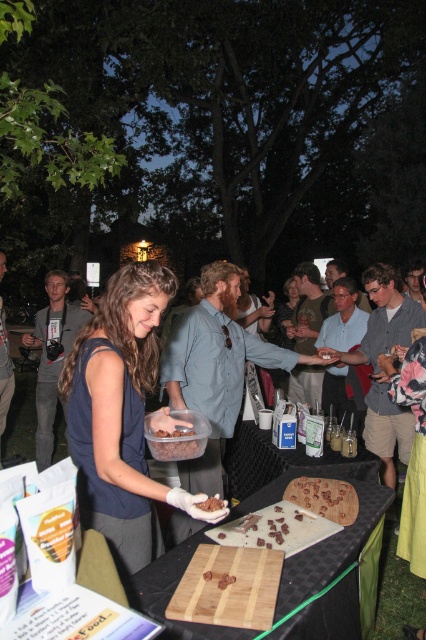
Is dark brown textured nuts at center behind chocolate crumbly at center?

Yes.

Find the location of a particular element. This screenshot has width=426, height=640. dark brown textured nuts at center is located at coordinates (176, 444).

Looking at this image, does matte blue shirt at center have a greater height compared to wooden cutting board at center?

Indeed, matte blue shirt at center has a greater height compared to wooden cutting board at center.

Find the location of a particular element. Image resolution: width=426 pixels, height=640 pixels. matte blue shirt at center is located at coordinates (121, 413).

What are the coordinates of `matte blue shirt at center` in the screenshot? It's located at (121, 413).

Which is more to the right, wooden cutting board at center or chocolate cake at center?

chocolate cake at center is more to the right.

At what (x,y) coordinates should I click in order to perform the action: click on wooden cutting board at center. Please return your answer as a coordinate pair (x, y). Looking at the image, I should click on (331, 550).